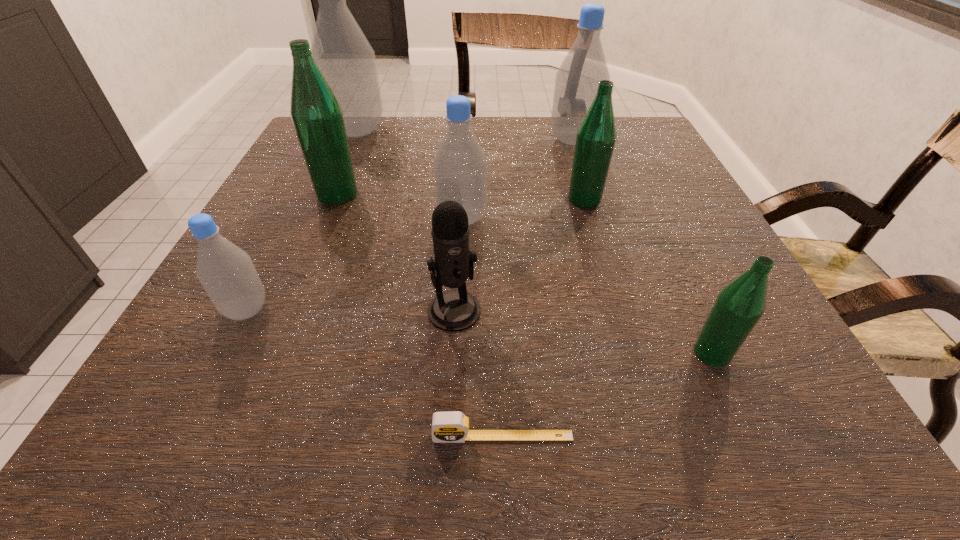
Identify the location of free point located 0.350m on the back of the smallest gray bottle. The image size is (960, 540). (313, 179).

This screenshot has height=540, width=960. I want to click on vacant space located 0.290m on the left of the rightmost green bottle, so click(492, 353).

I want to click on object at the near edge, so click(447, 427).

Locate an element on the screen. Image resolution: width=960 pixels, height=540 pixels. object situated at the far left corner is located at coordinates (340, 49).

Where is `object that is at the far right corner`? Image resolution: width=960 pixels, height=540 pixels. object that is at the far right corner is located at coordinates 576,82.

Locate an element on the screen. The height and width of the screenshot is (540, 960). vacant space at the far edge of the desktop is located at coordinates (398, 149).

The height and width of the screenshot is (540, 960). In the image, there is a desktop. Identify the location of vacant space at the near edge. (311, 398).

This screenshot has width=960, height=540. Identify the location of vacant space at the left edge of the desktop. (303, 170).

The image size is (960, 540). In order to click on free space at the right edge of the desktop in this screenshot , I will do (740, 273).

Find the location of a particular element. This screenshot has height=540, width=960. vacant area at the near right corner of the desktop is located at coordinates [x=761, y=388].